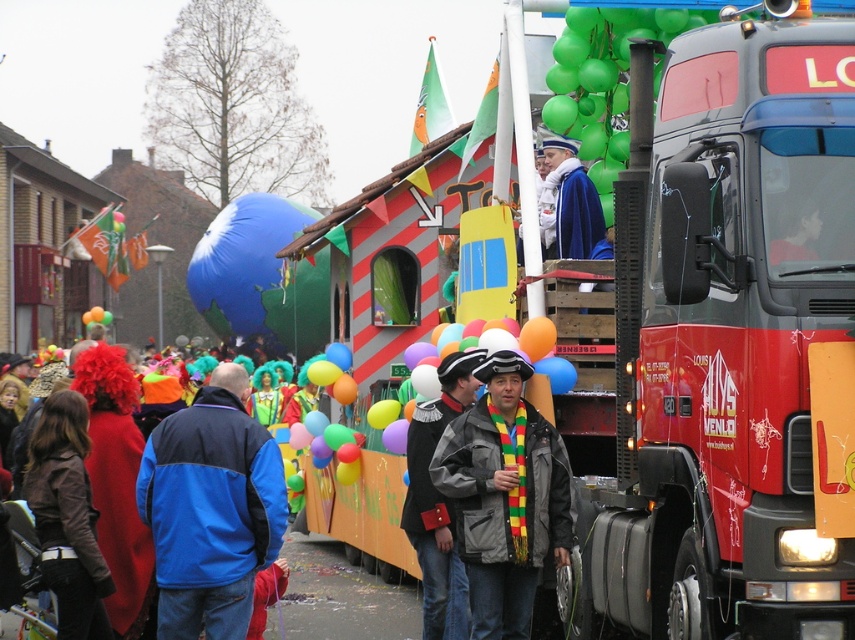
Question: Can you confirm if gray matte jacket at center is positioned to the right of blue glossy balloon at center?

Choices:
 (A) yes
 (B) no

Answer: (A)

Question: Based on their relative distances, which object is nearer to the red matte truck at center?

Choices:
 (A) blue glossy balloon at center
 (B) velvet black hat at center

Answer: (B)

Question: Is blue fleece jacket at center bigger than brown leather jacket at lower left?

Choices:
 (A) yes
 (B) no

Answer: (A)

Question: Estimate the real-world distances between objects in this image. Which object is farther from the brown leather jacket at lower left?

Choices:
 (A) blue fleece jacket at center
 (B) blue glossy balloon at center

Answer: (B)

Question: Which object is the farthest from the red matte truck at center?

Choices:
 (A) blue glossy balloon at center
 (B) brown leather jacket at lower left
 (C) gray matte jacket at center
 (D) velvet black hat at center

Answer: (A)

Question: In this image, where is gray matte jacket at center located relative to velvet black hat at center?

Choices:
 (A) right
 (B) left

Answer: (A)